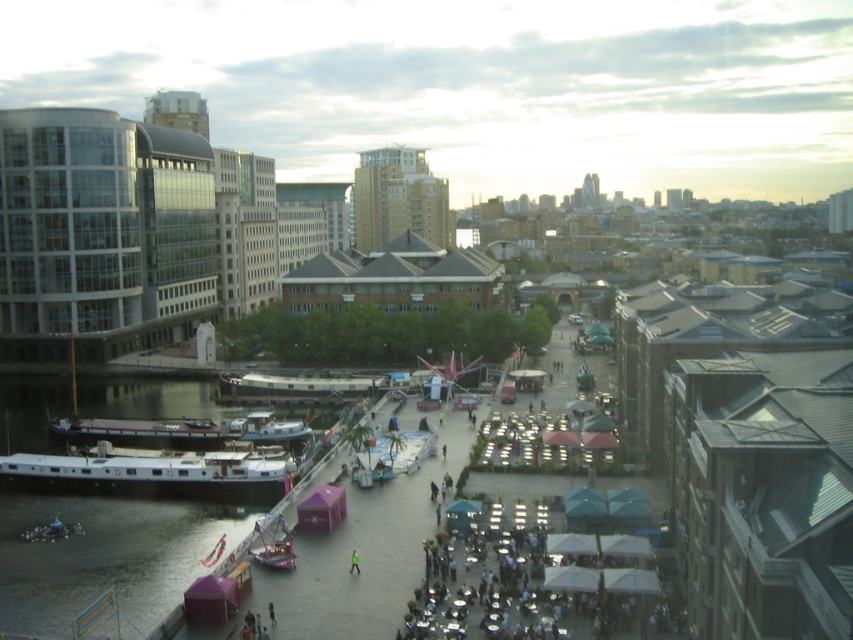
Question: Which of the following is the farthest from the observer?

Choices:
 (A) white glossy boat at lower left
 (B) yellow reflective vest at center

Answer: (A)

Question: Which object appears farthest from the camera in this image?

Choices:
 (A) white glossy boat at lower left
 (B) transparent glass boat at lower center

Answer: (A)

Question: Does white glossy boat at lower left appear under white wooden boat at lower left?

Choices:
 (A) no
 (B) yes

Answer: (B)

Question: Can you confirm if white glossy boat at lower left is positioned to the left of white wooden boat at lower left?

Choices:
 (A) no
 (B) yes

Answer: (B)

Question: Does white glossy boat at lower left lie in front of transparent glass boat at lower center?

Choices:
 (A) yes
 (B) no

Answer: (B)

Question: Which object is positioned farthest from the white wooden boat at lower left?

Choices:
 (A) white glossy boat at lower left
 (B) yellow reflective vest at center

Answer: (B)